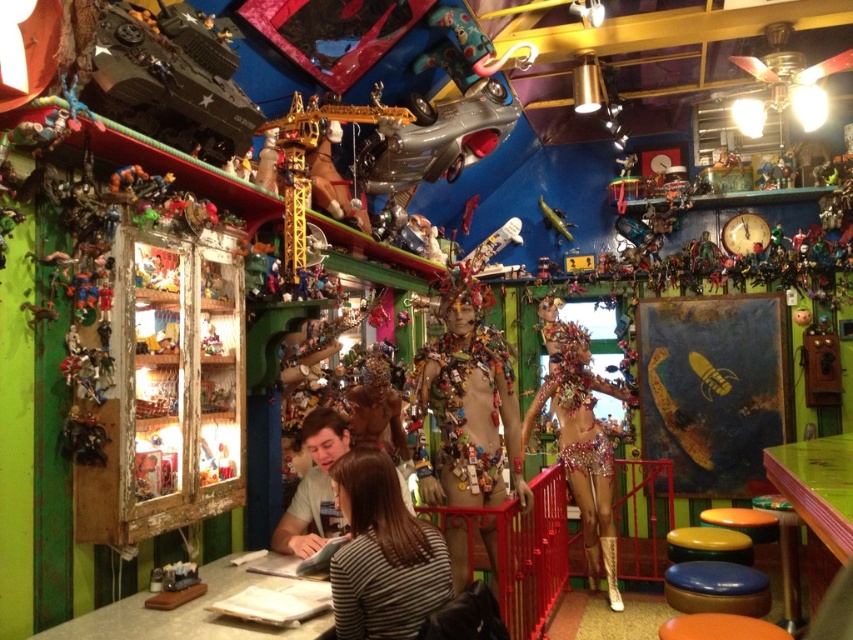
Who is shorter, blue leather stool at lower right or orange plastic stool at lower right?

orange plastic stool at lower right

Between blue leather stool at lower right and orange plastic stool at lower right, which one appears on the left side from the viewer's perspective?

From the viewer's perspective, orange plastic stool at lower right appears more on the left side.

Locate an element on the screen. This screenshot has height=640, width=853. blue leather stool at lower right is located at coordinates (717, 588).

Can you confirm if striped fabric shirt at center is bigger than metallic silver airplane at center?

Correct, striped fabric shirt at center is larger in size than metallic silver airplane at center.

Between striped fabric shirt at center and metallic silver airplane at center, which one appears on the right side from the viewer's perspective?

metallic silver airplane at center is more to the right.

Who is more distant from viewer, (366, 528) or (556, 236)?

Positioned behind is point (556, 236).

Identify the location of striped fabric shirt at center. The image size is (853, 640). (381, 554).

Is green laminate table at lower left smaller than green wood table at lower right?

Yes.

The image size is (853, 640). What are the coordinates of `green laminate table at lower left` in the screenshot? It's located at (186, 612).